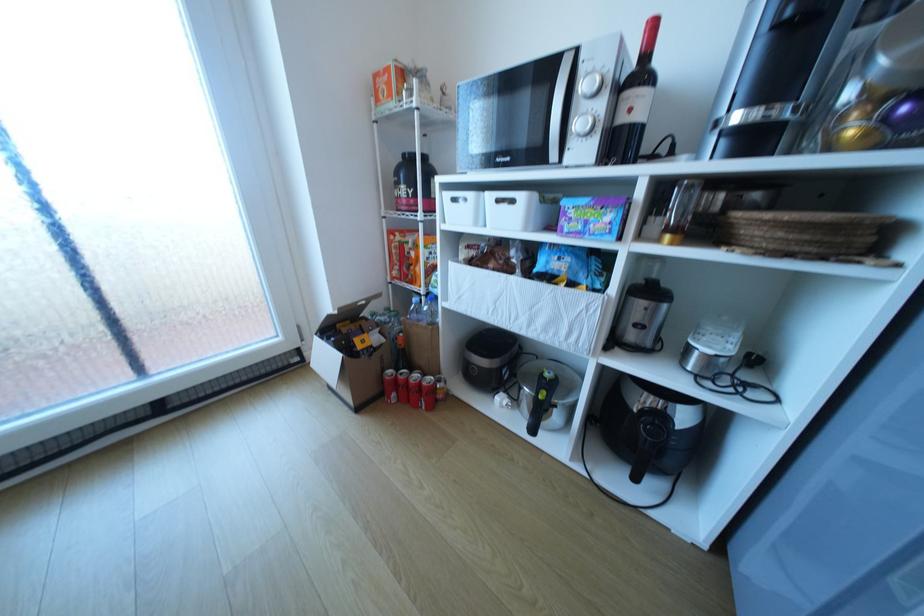
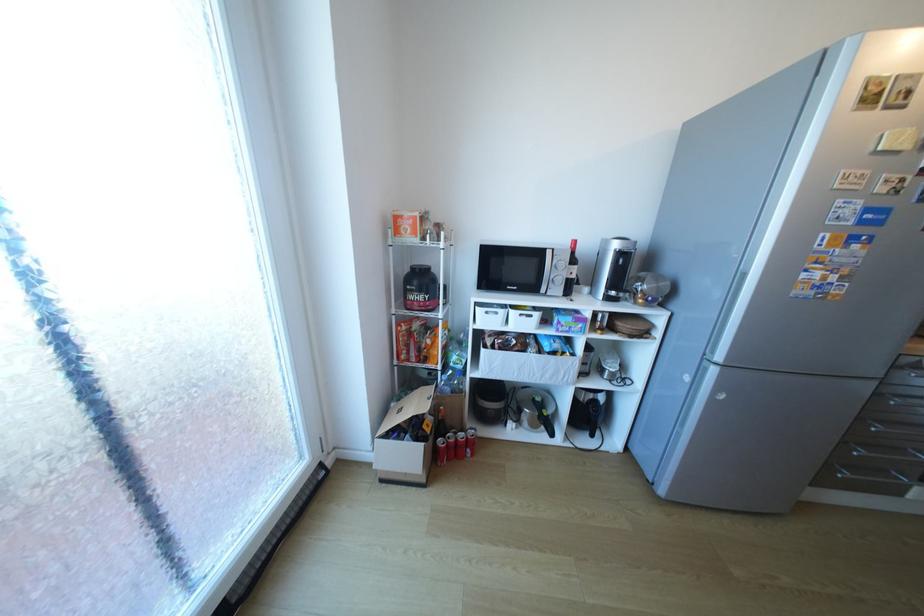
In the second image, find the point that corresponds to (422,379) in the first image.

(469, 439)